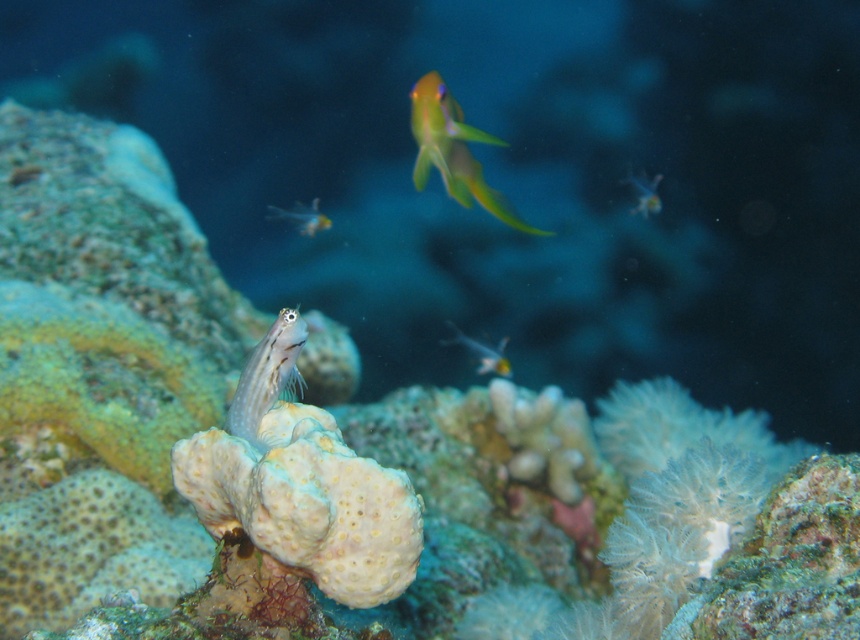
Question: Is green translucent fish at upper center wider than translucent glass fish at upper right?

Choices:
 (A) no
 (B) yes

Answer: (B)

Question: Which of the following is the farthest from the observer?

Choices:
 (A) (446, 108)
 (B) (654, 179)

Answer: (B)

Question: Does translucent blue fish at center have a smaller size compared to translucent yellow fish at upper center?

Choices:
 (A) no
 (B) yes

Answer: (B)

Question: Based on their relative distances, which object is nearer to the translucent blue fish at center?

Choices:
 (A) translucent yellow fish at upper center
 (B) translucent glass fish at center
 (C) translucent glass fish at upper right

Answer: (A)

Question: Which object appears farthest from the camera in this image?

Choices:
 (A) translucent yellow fish at upper center
 (B) translucent blue fish at center

Answer: (A)

Question: Can you confirm if green translucent fish at upper center is smaller than translucent glass fish at center?

Choices:
 (A) yes
 (B) no

Answer: (B)